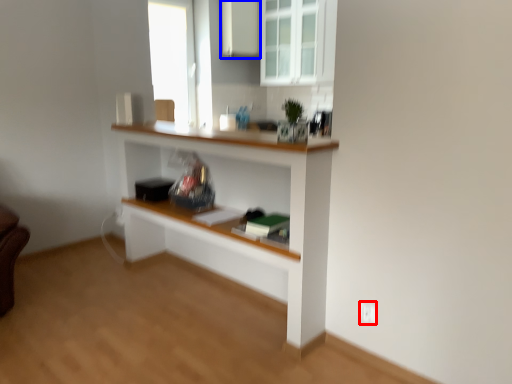
Question: Which object appears farthest to the camera in this image, electric outlet (highlighted by a red box) or cabinetry (highlighted by a blue box)?

Choices:
 (A) electric outlet
 (B) cabinetry

Answer: (B)